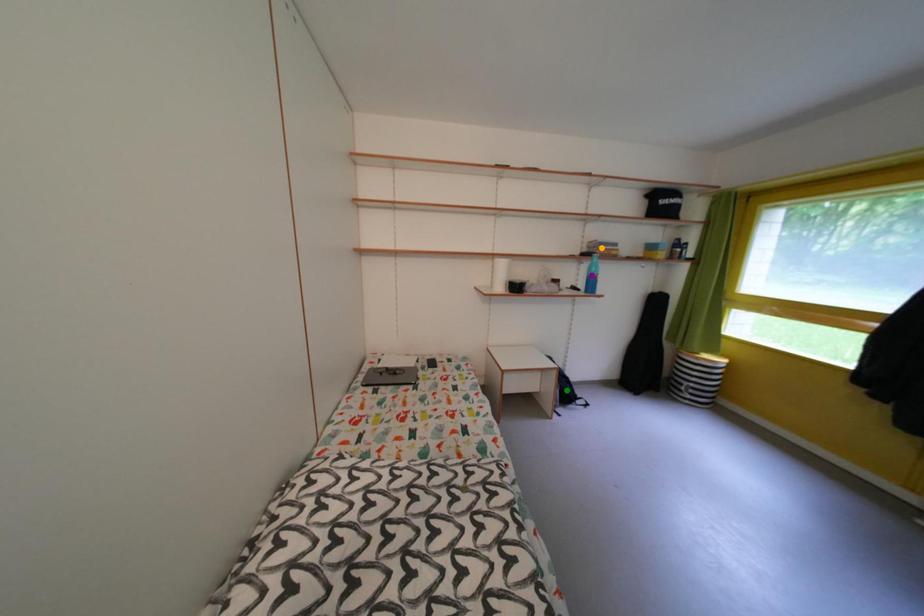
Order these from nearest to farthest:
1. orange point
2. green point
3. purple point

1. green point
2. purple point
3. orange point